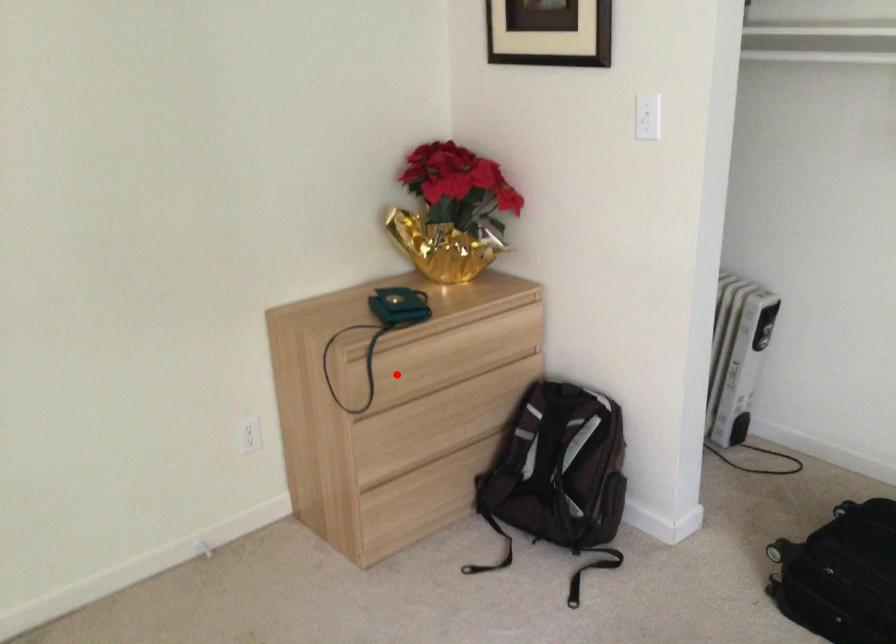
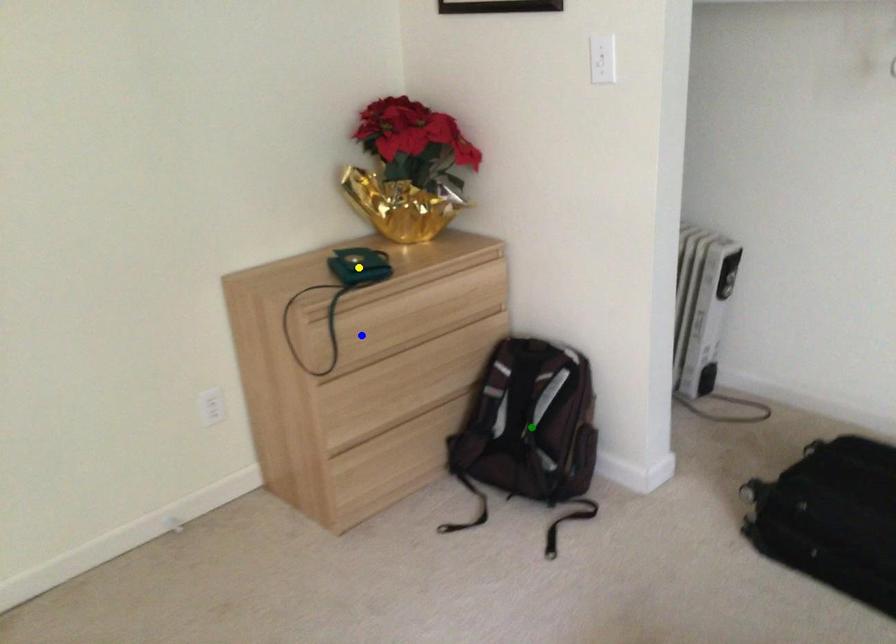
Question: I am providing you with two images of the same scene from different viewpoints. A red point is marked on the first image. You are given multiple points on the second image. Which point in image 2 represents the same 3d spot as the red point in image 1?

Choices:
 (A) blue point
 (B) yellow point
 (C) green point

Answer: (A)